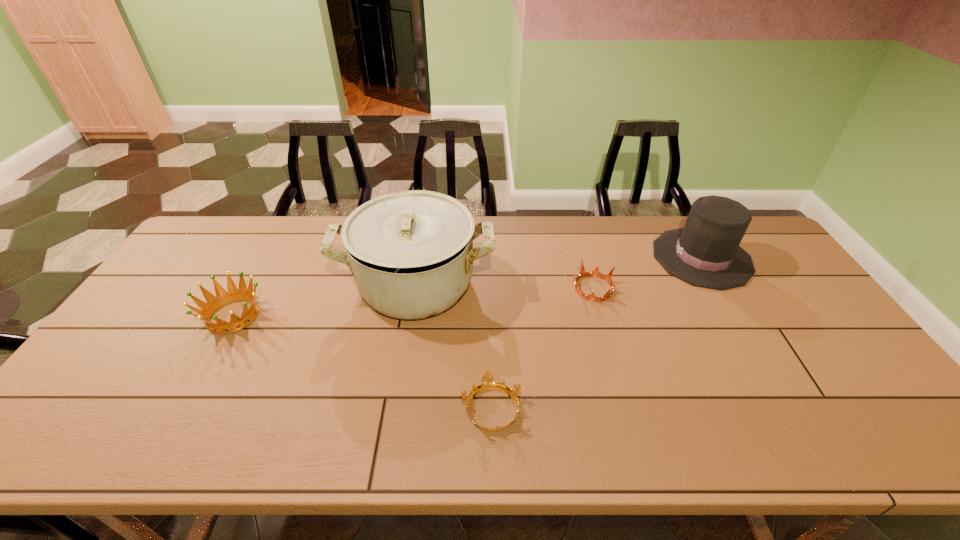
What are the coordinates of `saucepan` in the screenshot? It's located at (411, 253).

This screenshot has width=960, height=540. What are the coordinates of `dress hat` in the screenshot? It's located at (706, 253).

Locate an element on the screen. The width and height of the screenshot is (960, 540). the fourth shortest object is located at coordinates (706, 253).

Locate an element on the screen. This screenshot has width=960, height=540. the leftmost object is located at coordinates pos(223,297).

Find the location of a particular element. This screenshot has height=540, width=960. the tallest crown is located at coordinates (223, 297).

At what (x,y) coordinates should I click in order to perform the action: click on the rightmost crown. Please return your answer as a coordinate pair (x, y). This screenshot has height=540, width=960. Looking at the image, I should click on (608, 278).

The image size is (960, 540). I want to click on the nearest object, so click(x=488, y=384).

Where is `the nearest crown`? the nearest crown is located at coordinates (488, 384).

Where is `free region located on the left of the saucepan`? This screenshot has height=540, width=960. free region located on the left of the saucepan is located at coordinates (257, 285).

You are a GUI agent. You are given a task and a screenshot of the screen. Output one action in this format:
    pyautogui.click(x=<x>, y=<y>)
    Task: Click on the vacant area located 0.380m on the front of the fourth shortest object with the decoration
    
    Given the screenshot: What is the action you would take?
    pyautogui.click(x=538, y=258)